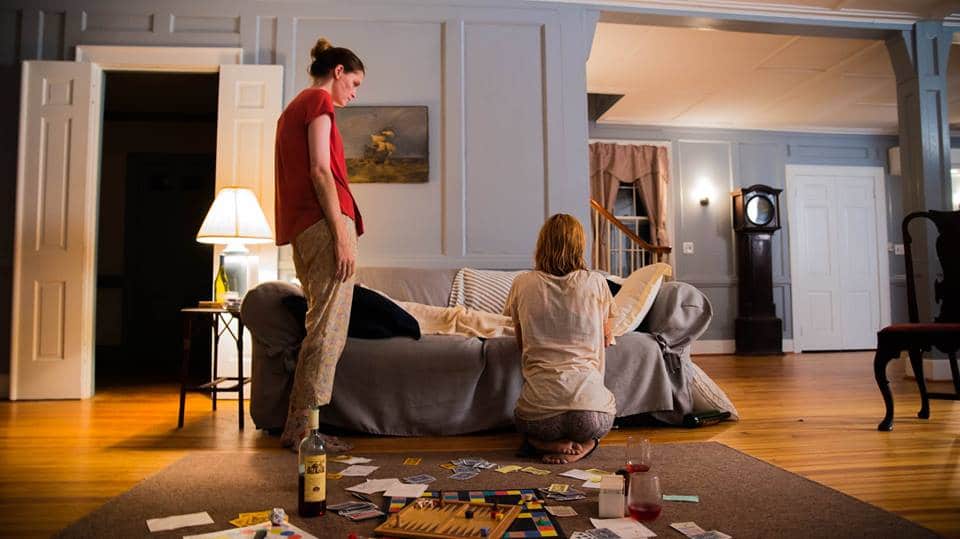
Image resolution: width=960 pixels, height=539 pixels. In order to click on doors in this screenshot , I will do `click(844, 224)`, `click(70, 338)`, `click(237, 87)`.